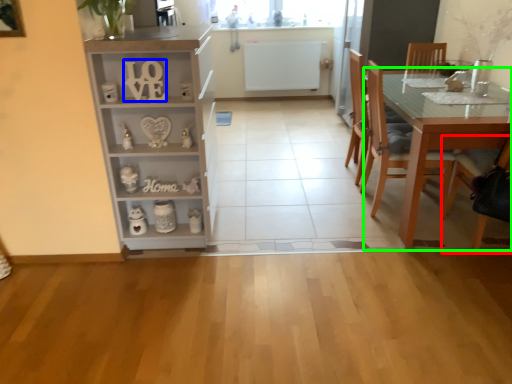
Question: Which is farther away from chair (highlighted by a red box)? number (highlighted by a blue box) or table (highlighted by a green box)?

Choices:
 (A) number
 (B) table

Answer: (A)